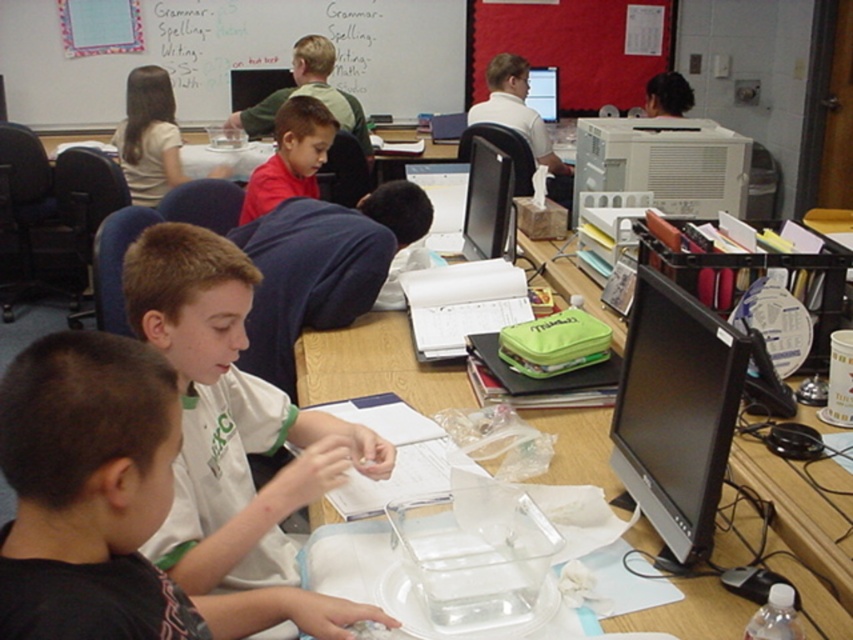
At what (x,y) coordinates should I click in order to perform the action: click on white cotton shirt at center. Please return your answer as a coordinate pair (x, y). Looking at the image, I should click on (229, 417).

Who is more forward, (306, 465) or (311, 122)?

Point (306, 465) is in front.

The image size is (853, 640). I want to click on white cotton shirt at center, so pyautogui.click(x=229, y=417).

Between point (131, 120) and point (463, 214), which one is positioned in front?

Positioned in front is point (463, 214).

Is light beige shirt at upper left to the left of black glossy monitor at center from the viewer's perspective?

Indeed, light beige shirt at upper left is positioned on the left side of black glossy monitor at center.

I want to click on light beige shirt at upper left, so click(149, 136).

Does clear plastic tray at center have a greater height compared to black glossy computer monitor at right?

Incorrect, clear plastic tray at center's height is not larger of black glossy computer monitor at right's.

Is clear plastic tray at center smaller than black glossy computer monitor at right?

Actually, clear plastic tray at center might be larger than black glossy computer monitor at right.

Which is in front, point (335, 365) or point (628, 436)?

Point (628, 436)

Where is `clear plastic tray at center`? clear plastic tray at center is located at coordinates (376, 365).